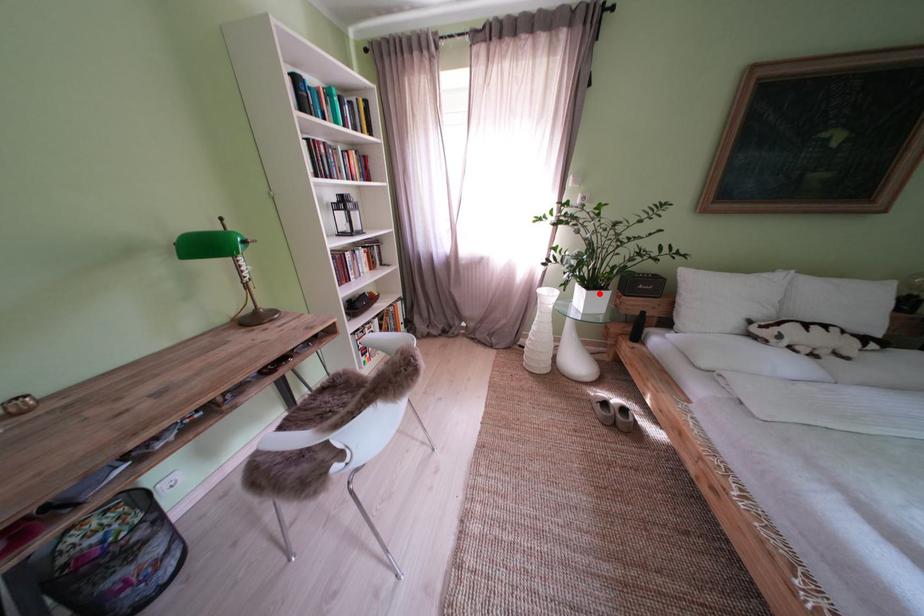
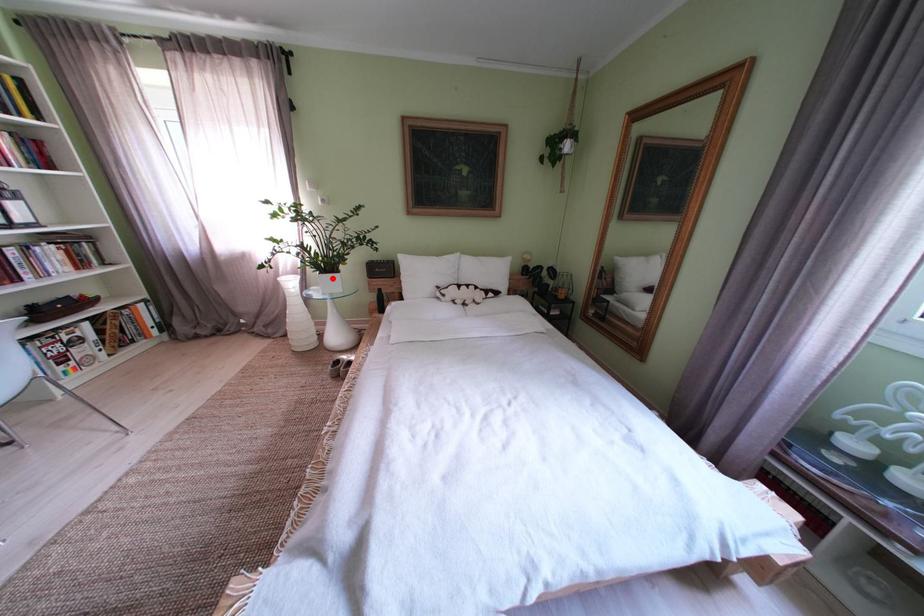
I am providing you with two images of the same scene from different viewpoints. A red point is marked on the first image and another point is marked on the second image. Do the highlighted points in image1 and image2 indicate the same real-world spot?

Yes